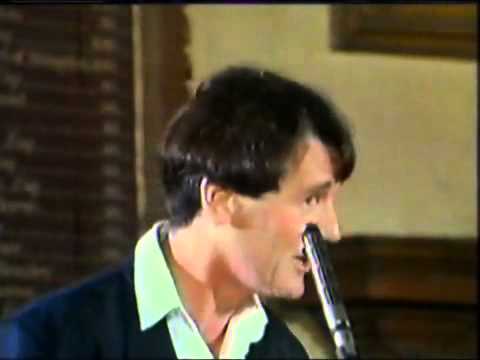
Locate an element on the screen. Image resolution: width=480 pixels, height=360 pixels. frame is located at coordinates (363, 36).